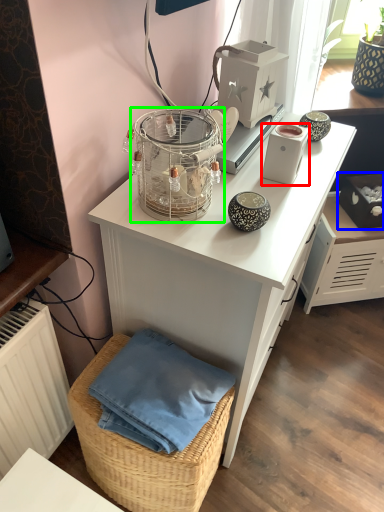
Question: Which object is positioned closest to appliance (highlighted by a red box)? Select from box (highlighted by a blue box) and bird cage (highlighted by a green box).

Choices:
 (A) box
 (B) bird cage

Answer: (B)